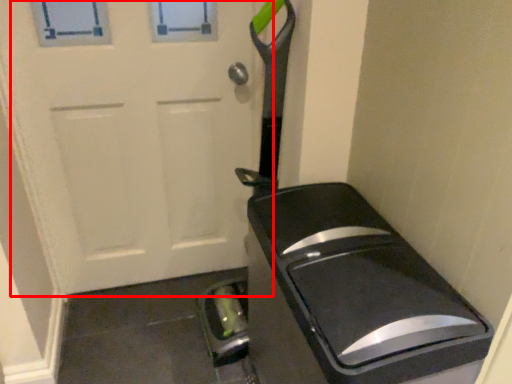
Question: From the image, what is the correct spatial relationship of door (annotated by the red box) in relation to appliance?

Choices:
 (A) left
 (B) right

Answer: (A)